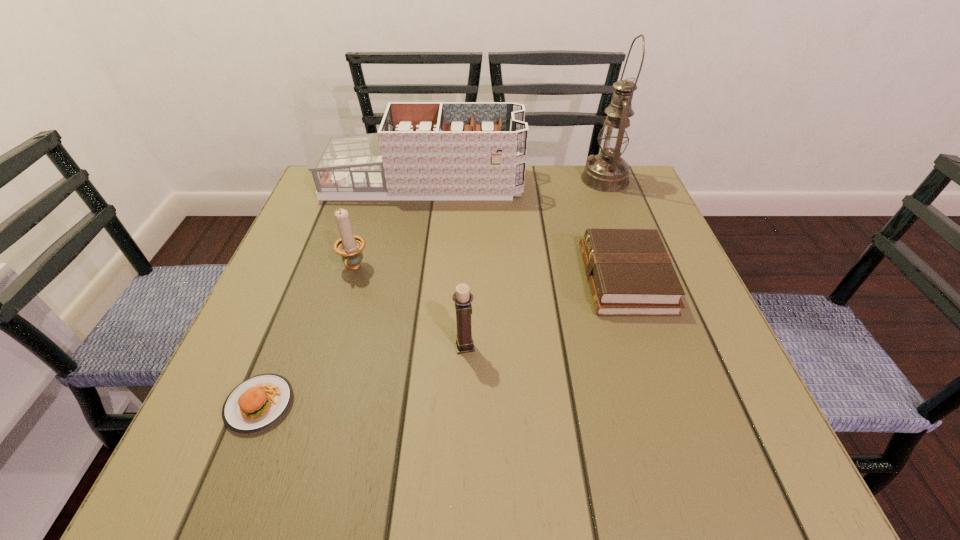
Locate an element on the screen. The image size is (960, 540). vacant space that's between the fifth shortest object and the nearer candle_holder is located at coordinates (444, 265).

Identify which object is the nearest to the oil lamp. Please provide its 2D coordinates. Your answer should be formatted as a tuple, i.e. [(x, y)], where the tuple contains the x and y coordinates of a point satisfying the conditions above.

[(423, 150)]

Image resolution: width=960 pixels, height=540 pixels. Find the location of `object identified as the third closest to the farther candle_holder`. object identified as the third closest to the farther candle_holder is located at coordinates (462, 298).

Find the location of a particular element. The image size is (960, 540). free space that satisfies the following two spatial constraints: 1. on the spine side of the second shortest object; 2. on the front side of the nearer candle_holder is located at coordinates (648, 346).

This screenshot has width=960, height=540. Identify the location of vacant position in the image that satisfies the following two spatial constraints: 1. at the entrance of the dollhouse; 2. on the back side of the right candle_holder. (396, 346).

Where is `vacant area in the image that satisfies the following two spatial constraints: 1. on the handle side of the second nearest object; 2. on the right side of the farther candle_holder`? vacant area in the image that satisfies the following two spatial constraints: 1. on the handle side of the second nearest object; 2. on the right side of the farther candle_holder is located at coordinates (331, 346).